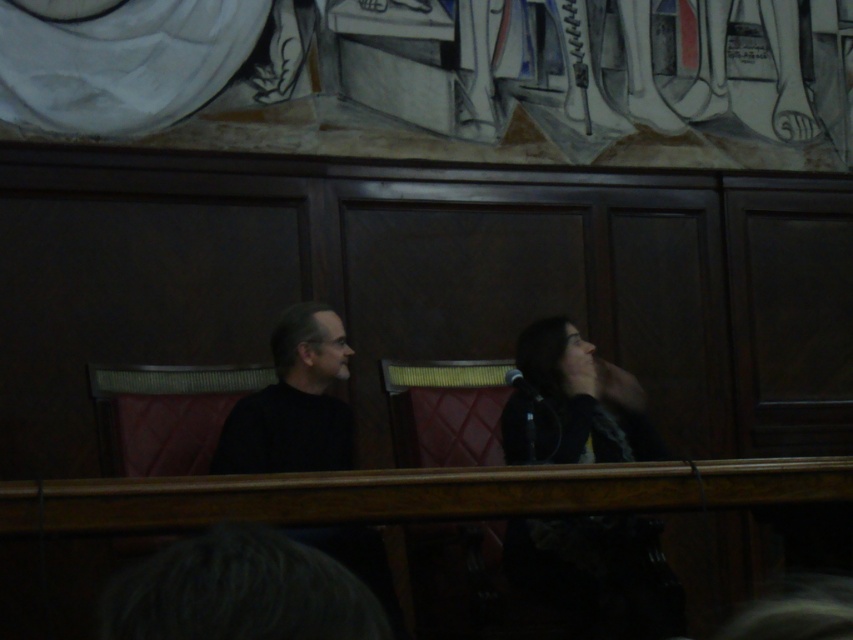
Question: Among these objects, which one is nearest to the camera?

Choices:
 (A) black matte jacket at right
 (B) black matte shirt at left

Answer: (A)

Question: Does black matte jacket at right lie behind black matte shirt at left?

Choices:
 (A) no
 (B) yes

Answer: (A)

Question: Is black matte jacket at right in front of black matte shirt at left?

Choices:
 (A) no
 (B) yes

Answer: (B)

Question: Which object appears farthest from the camera in this image?

Choices:
 (A) black matte jacket at right
 (B) black matte shirt at left

Answer: (B)

Question: Can you confirm if black matte jacket at right is positioned above black matte shirt at left?

Choices:
 (A) yes
 (B) no

Answer: (B)